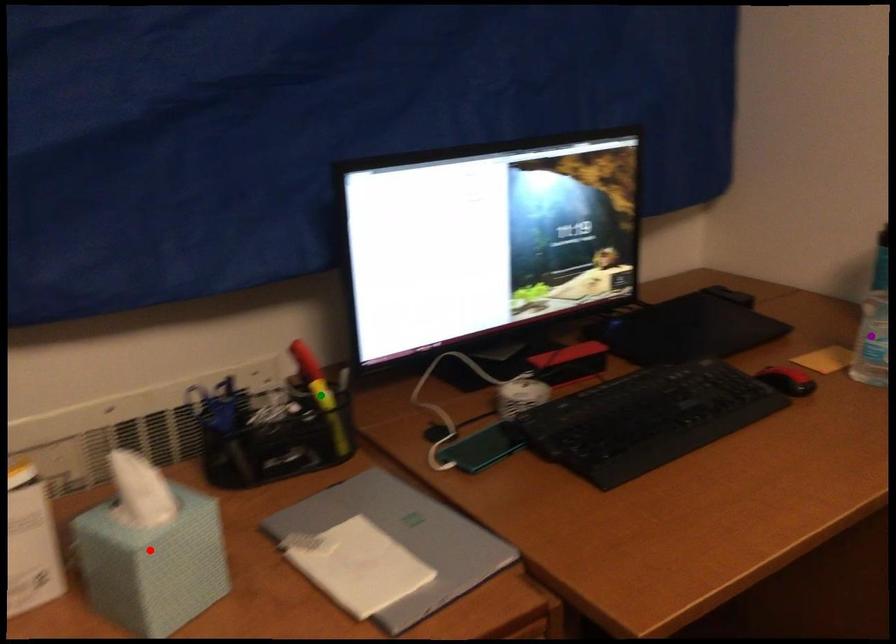
Order these from nearest to farthest:
1. purple point
2. red point
3. green point

red point → green point → purple point